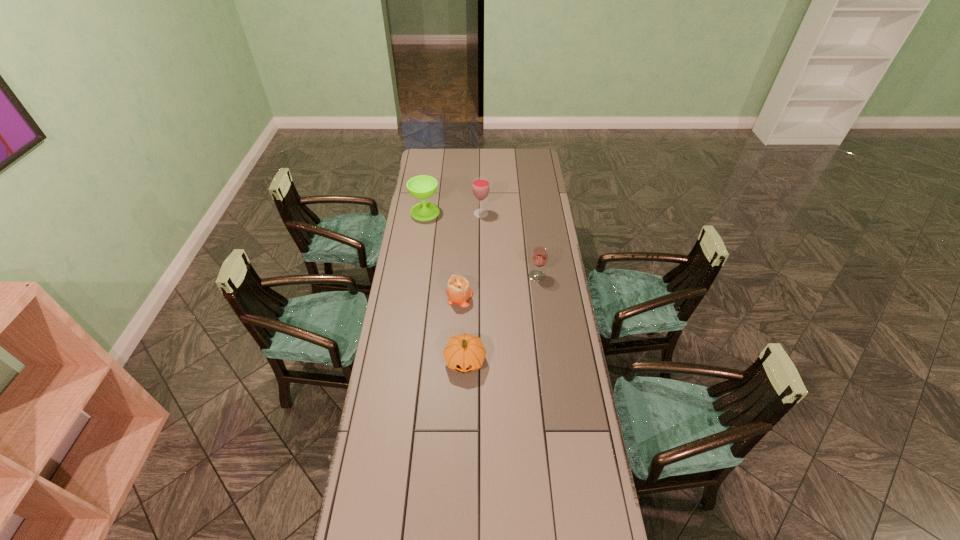
Locate an element on the screen. the second wineglass from left to right is located at coordinates (480, 186).

Find the location of a particular element. Image resolution: width=960 pixels, height=540 pixels. the leftmost object is located at coordinates (422, 187).

Locate an element on the screen. This screenshot has width=960, height=540. the rightmost object is located at coordinates (539, 257).

You are a GUI agent. You are given a task and a screenshot of the screen. Output one action in this format:
    pyautogui.click(x=<x>, y=<y>)
    Task: Click on the shortest wineglass
    This screenshot has height=540, width=960.
    Given the screenshot: What is the action you would take?
    pyautogui.click(x=539, y=257)

Find the location of a particular element. the second nearest object is located at coordinates (458, 290).

Find the location of a particular element. gourd is located at coordinates (464, 353).

You are a GUI agent. You are given a task and a screenshot of the screen. Output one action in this format:
    pyautogui.click(x=<x>, y=<y>)
    Task: Click on the vacant space situated 0.180m on the back of the second wineglass from right to left
    
    Given the screenshot: What is the action you would take?
    pyautogui.click(x=481, y=188)

Identify the location of vacant space situated on the back of the leftmost wineglass. (430, 179).

At what (x,y) coordinates should I click in order to perform the action: click on free space located on the back of the third farthest object. Please return your answer as a coordinate pair (x, y). The image size is (960, 540). Looking at the image, I should click on (533, 238).

The image size is (960, 540). I want to click on free space located 0.380m on the back of the candle, so click(463, 230).